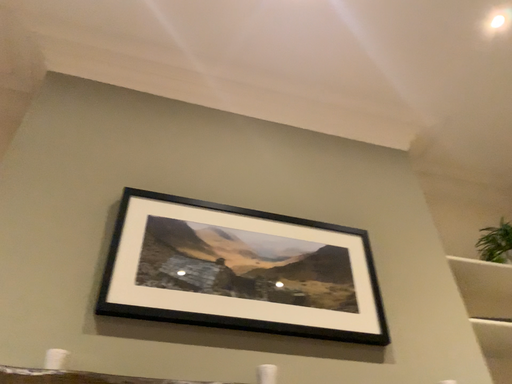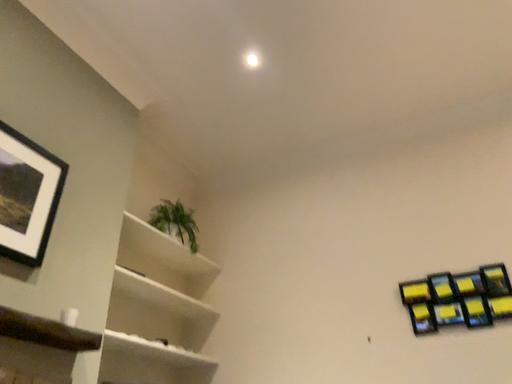
Question: How did the camera likely rotate when shooting the video?

Choices:
 (A) rotated downward
 (B) rotated upward

Answer: (A)